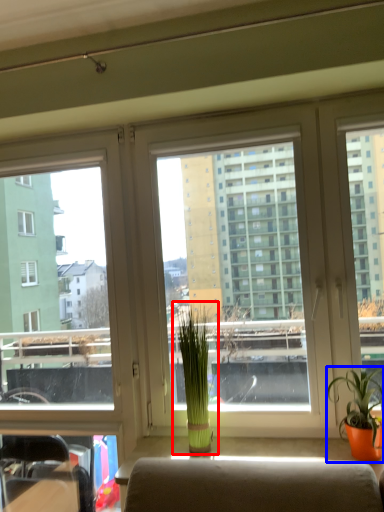
Question: Which object appears farthest to the camera in this image, houseplant (highlighted by a red box) or houseplant (highlighted by a blue box)?

Choices:
 (A) houseplant
 (B) houseplant

Answer: (A)